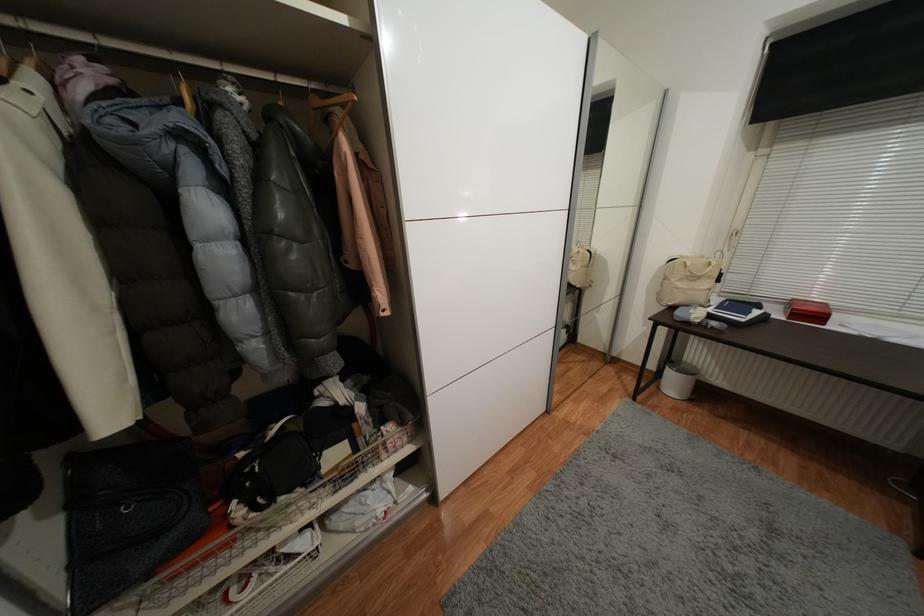
The image size is (924, 616). I want to click on red lidded box, so click(x=808, y=310).